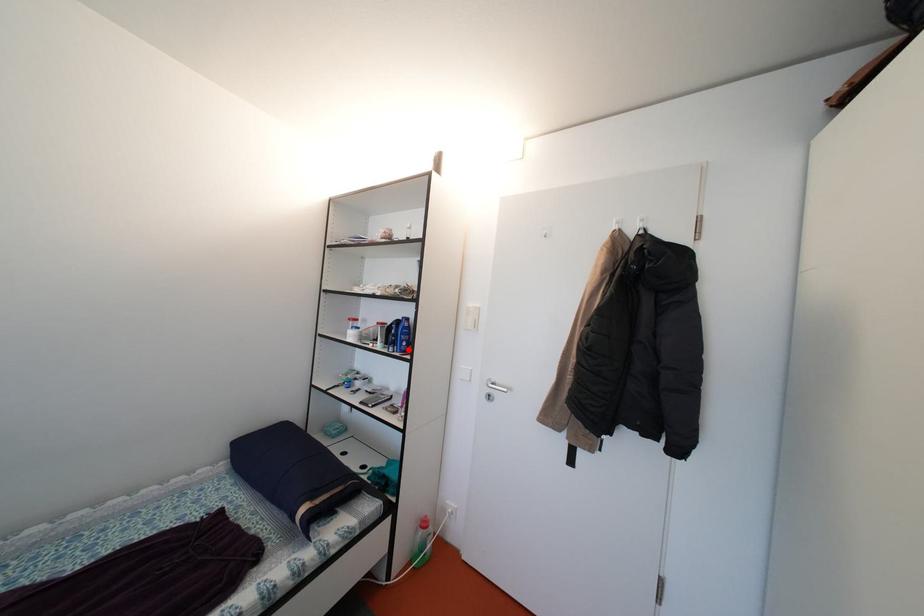
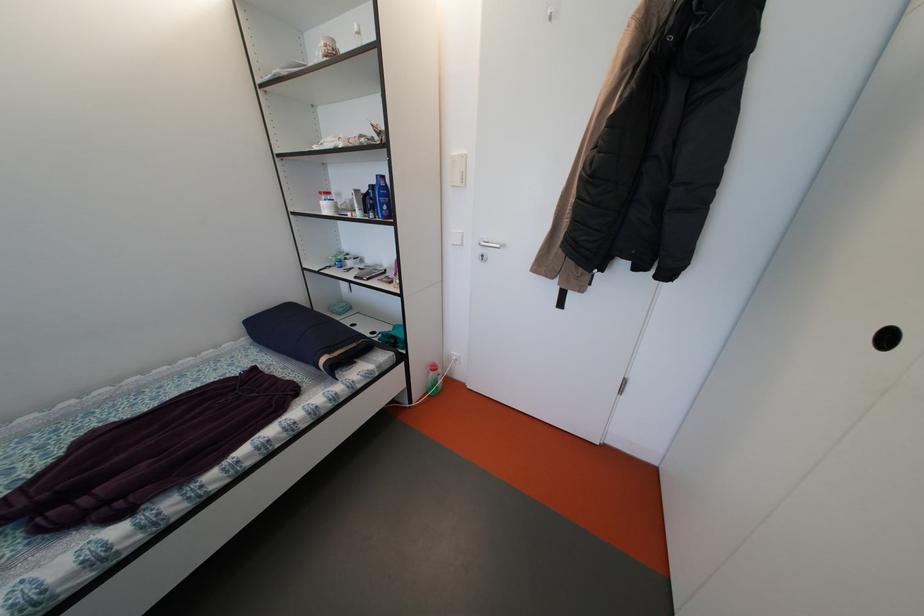
Question: I am providing you with two images of the same scene from different viewpoints. In image1, a red point is highlighted. Considering the same 3D point in image2, which of the following is correct?

Choices:
 (A) It is closer
 (B) It is farther

Answer: (A)